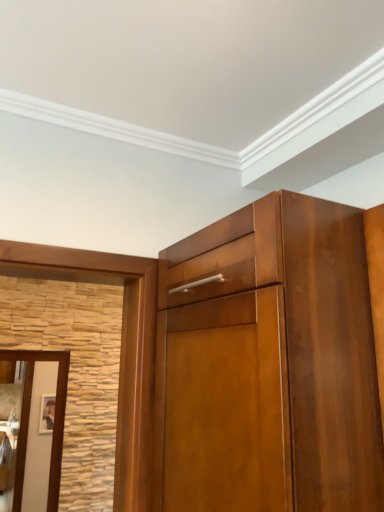
Question: Considering their positions, is brown wooden door at left located in front of or behind glossy wood cupboard at upper center?

Choices:
 (A) behind
 (B) front

Answer: (A)

Question: Is brown wooden door at left taller or shorter than glossy wood cupboard at upper center?

Choices:
 (A) short
 (B) tall

Answer: (B)

Question: Considering the positions of point (38, 432) and point (269, 409), is point (38, 432) closer or farther from the camera than point (269, 409)?

Choices:
 (A) closer
 (B) farther

Answer: (B)

Question: Do you think glossy wood cupboard at upper center is within brown wooden door at left, or outside of it?

Choices:
 (A) inside
 (B) outside

Answer: (B)

Question: Based on their positions, is glossy wood cupboard at upper center located to the left or right of brown wooden door at left?

Choices:
 (A) right
 (B) left

Answer: (A)

Question: Based on their sizes in the image, would you say glossy wood cupboard at upper center is bigger or smaller than brown wooden door at left?

Choices:
 (A) small
 (B) big

Answer: (B)

Question: Looking at their shapes, would you say glossy wood cupboard at upper center is wider or thinner than brown wooden door at left?

Choices:
 (A) thin
 (B) wide

Answer: (B)